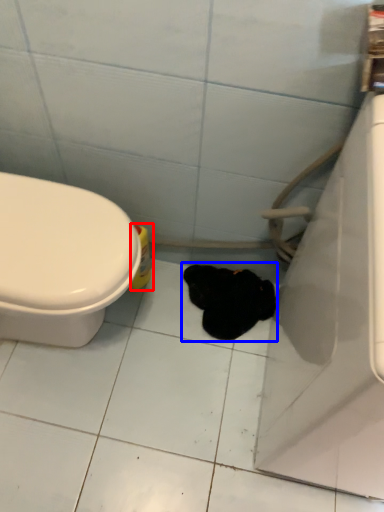
Question: Which object appears farthest to the camera in this image, cleaning product (highlighted by a red box) or animal (highlighted by a blue box)?

Choices:
 (A) cleaning product
 (B) animal

Answer: (B)